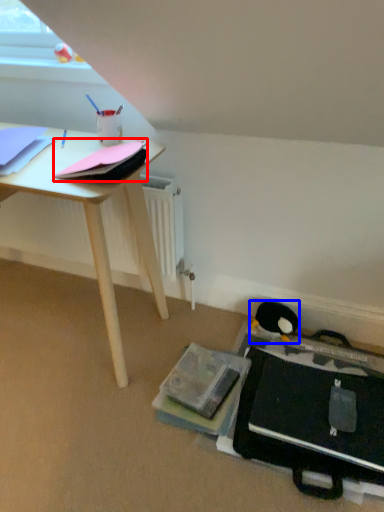
Question: Which point is closer to the camera, paperback book (highlighted by a red box) or penguin (highlighted by a blue box)?

Choices:
 (A) paperback book
 (B) penguin

Answer: (A)